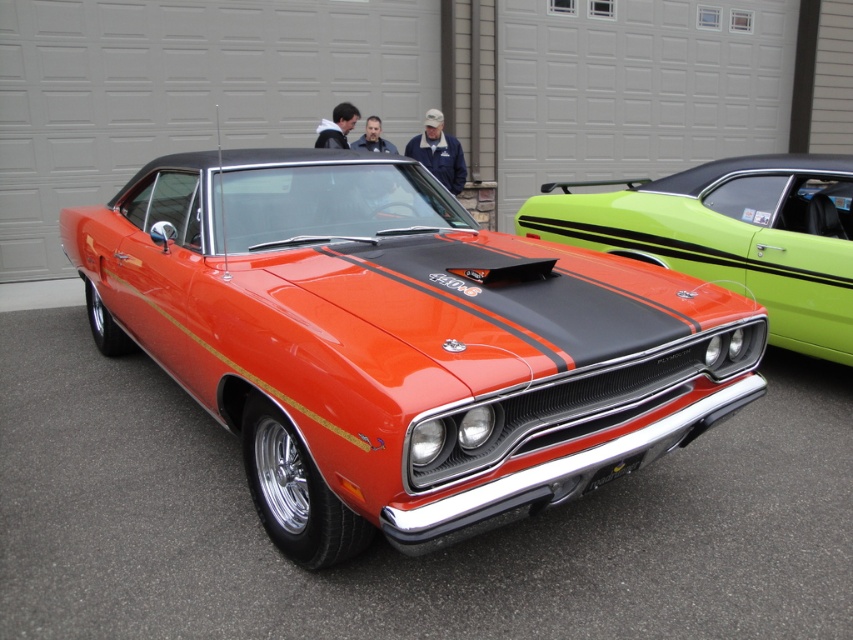
Question: Where is shiny orange muscle car at center located in relation to glossy orange car at center in the image?

Choices:
 (A) below
 (B) above

Answer: (A)

Question: Is shiny orange muscle car at center positioned behind glossy orange car at center?

Choices:
 (A) no
 (B) yes

Answer: (A)

Question: Which of the following is the farthest from the observer?

Choices:
 (A) (479, 230)
 (B) (618, 212)

Answer: (B)

Question: Is the position of shiny orange muscle car at center less distant than that of glossy orange car at center?

Choices:
 (A) yes
 (B) no

Answer: (A)

Question: Which point is farther to the camera?

Choices:
 (A) glossy orange car at center
 (B) shiny orange muscle car at center

Answer: (A)

Question: Which point is farther to the camera?

Choices:
 (A) shiny orange muscle car at center
 (B) glossy orange car at center

Answer: (B)